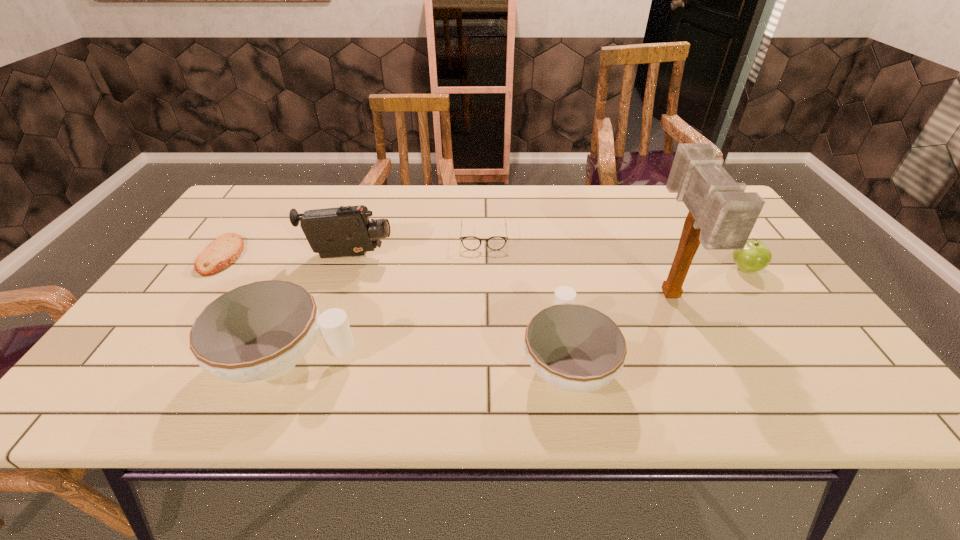
This screenshot has height=540, width=960. Find the location of `free spot that satisfies the following two spatial constraints: 1. on the side with the handle of the right chinaware; 2. on the side with the handle of the fifth shortest object`. free spot that satisfies the following two spatial constraints: 1. on the side with the handle of the right chinaware; 2. on the side with the handle of the fifth shortest object is located at coordinates (566, 360).

Locate an element on the screen. vacant space that satisfies the following two spatial constraints: 1. on the front-facing side of the second tallest object; 2. on the side with the handle of the right chinaware is located at coordinates (311, 362).

Find the location of a particular element. vacant region that satisfies the following two spatial constraints: 1. on the side with the handle of the fifth object from left to right; 2. on the side with the handle of the taller chinaware is located at coordinates (566, 360).

Identify the location of free space that satisfies the following two spatial constraints: 1. through the lenses of the fourth object from left to right; 2. on the left side of the apple. (484, 269).